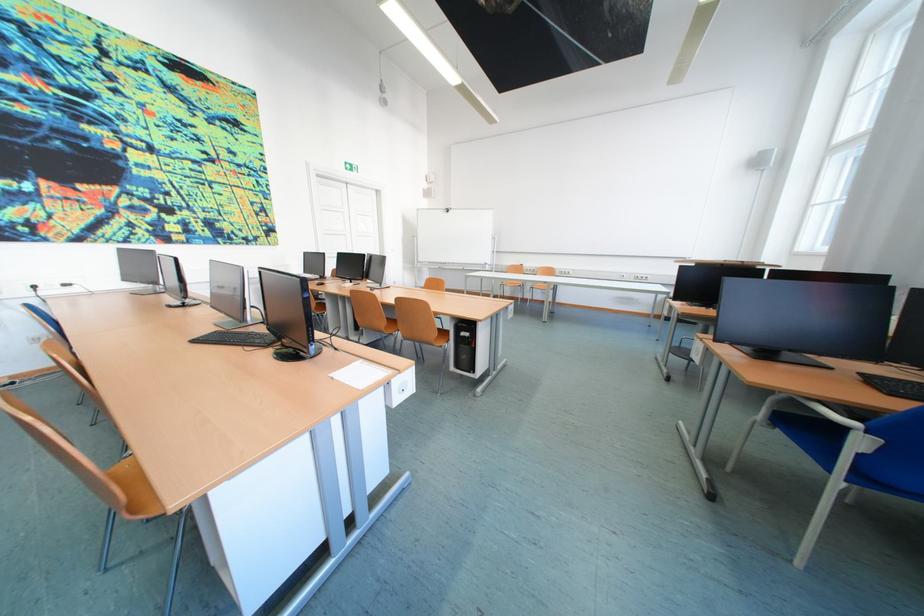
What do you see at coordinates (131, 479) in the screenshot? Image resolution: width=924 pixels, height=616 pixels. I see `a orange chair sitting surface` at bounding box center [131, 479].